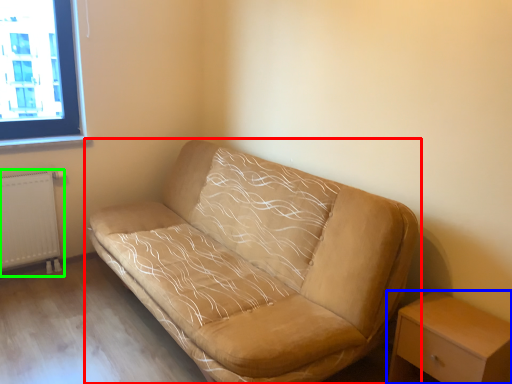
Question: Estimate the real-world distances between objects in this image. Which object is farther from studio couch (highlighted by a red box), nightstand (highlighted by a blue box) or radiator (highlighted by a green box)?

Choices:
 (A) nightstand
 (B) radiator

Answer: (B)